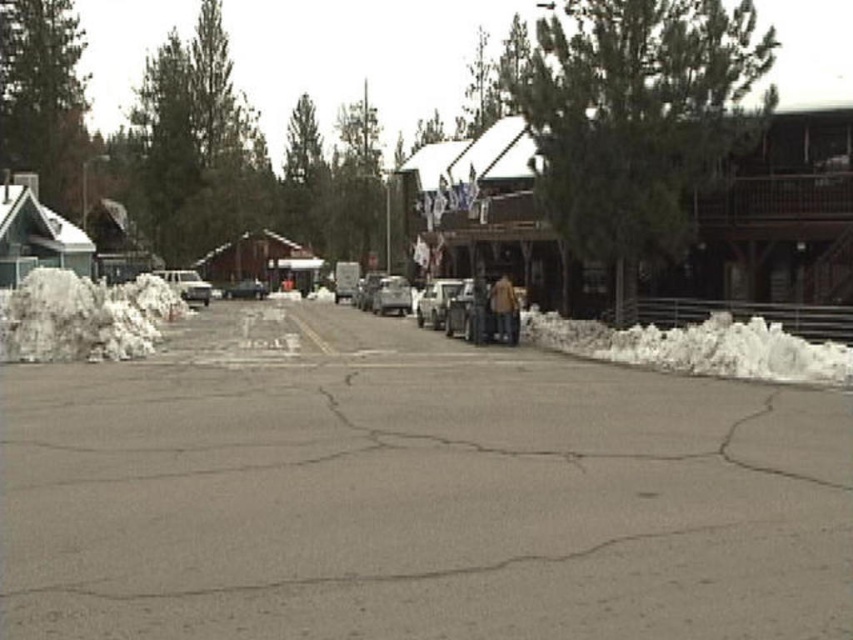
Question: Which object appears closest to the camera in this image?

Choices:
 (A) green leafy tree at center
 (B) white fluffy snow at left

Answer: (B)

Question: Does gray asphalt parking lot at center appear under shiny silver sedan at center?

Choices:
 (A) no
 (B) yes

Answer: (B)

Question: Which point is farther to the camera?

Choices:
 (A) (665, 499)
 (B) (74, 173)
 (C) (421, 307)

Answer: (B)

Question: Which object is positioned farthest from the white matte car at center?

Choices:
 (A) metallic silver sedan at center
 (B) white fluffy snow at right
 (C) silver metallic car at center

Answer: (C)

Question: Can you confirm if white matte car at center is positioned to the right of shiny silver sedan at center?

Choices:
 (A) no
 (B) yes

Answer: (B)

Question: Does green textured pine tree at center have a lesser width compared to green textured pine tree at upper left?

Choices:
 (A) yes
 (B) no

Answer: (B)